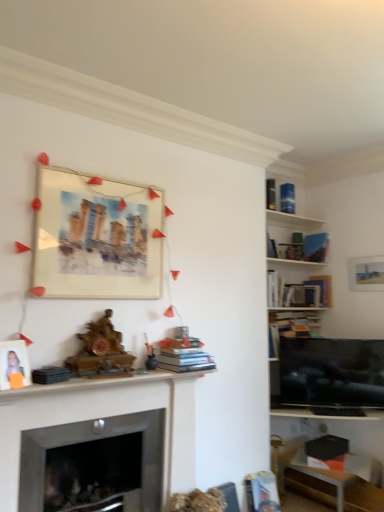
Measure the distance between point [313,228] and camera.

They are 4.35 meters apart.

Identify the location of white wooden shelf at upper right. (292, 221).

The width and height of the screenshot is (384, 512). What are the coordinates of `watercolor paper painting at upper left, the second picture frame ordered from the bottom` in the screenshot? It's located at (97, 237).

Image resolution: width=384 pixels, height=512 pixels. What do you see at coordinates (97, 237) in the screenshot?
I see `watercolor paper painting at upper left, the second picture frame ordered from the bottom` at bounding box center [97, 237].

Measure the distance between point (383,362) and camera.

Point (383,362) is 3.52 meters from camera.

What do you see at coordinates (322, 288) in the screenshot?
I see `hardcover book at center-right, which is the 4th book from front to back` at bounding box center [322, 288].

This screenshot has height=512, width=384. What are the coordinates of `hardcover book at upper right, which is the 4th book from back to front` in the screenshot? It's located at (271, 194).

What do you see at coordinates (104, 419) in the screenshot?
I see `wooden mantelpiece at center` at bounding box center [104, 419].

Identify the location of white wooden shelf at upper right. (292, 221).

From the image's perspective, is watercolor paper painting at upper left, the second picture frame ordered from the bottom, beneath blue matte bookshelf at upper right, the third book from the top?

Incorrect, from the image's perspective, watercolor paper painting at upper left, the second picture frame ordered from the bottom, is higher than blue matte bookshelf at upper right, the third book from the top.

Is point (58, 218) closer or farther from the camera than point (323, 255)?

Point (58, 218) is positioned closer to the camera compared to point (323, 255).

Is watercolor paper painting at upper left, marked as the 1th picture frame in a top-to-bottom arrangement, oriented away from blue matte bookshelf at upper right, arranged as the 1th book when viewed from the back?

No, watercolor paper painting at upper left, marked as the 1th picture frame in a top-to-bottom arrangement,'s orientation is not away from blue matte bookshelf at upper right, arranged as the 1th book when viewed from the back.

Which object is positioned more to the left, watercolor paper painting at upper left, placed as the 1th picture frame when sorted from right to left, or blue matte bookshelf at upper right, which ranks as the 6th book in left-to-right order?

watercolor paper painting at upper left, placed as the 1th picture frame when sorted from right to left, is more to the left.

Considering the positions of objects blue matte bookshelf at upper right, which ranks as the 6th book in left-to-right order, and watercolor paper painting at upper left, marked as the 1th picture frame in a top-to-bottom arrangement, in the image provided, who is behind, blue matte bookshelf at upper right, which ranks as the 6th book in left-to-right order, or watercolor paper painting at upper left, marked as the 1th picture frame in a top-to-bottom arrangement,?

blue matte bookshelf at upper right, which ranks as the 6th book in left-to-right order, is further from the camera.

Is blue matte bookshelf at upper right, the third book from the top, far from watercolor paper painting at upper left, which is the 1th picture frame in back-to-front order?

Yes, blue matte bookshelf at upper right, the third book from the top, and watercolor paper painting at upper left, which is the 1th picture frame in back-to-front order, are located far from each other.

From the image's perspective, which object appears higher, blue matte bookshelf at upper right, which ranks as the 6th book in left-to-right order, or watercolor paper painting at upper left, the second picture frame in the front-to-back sequence?

watercolor paper painting at upper left, the second picture frame in the front-to-back sequence.

Considering the relative positions of blue matte bookshelf at upper right, the third book from the top, and watercolor paper painting at upper left, which is the 1th picture frame in back-to-front order, in the image provided, is blue matte bookshelf at upper right, the third book from the top, to the left or to the right of watercolor paper painting at upper left, which is the 1th picture frame in back-to-front order,?

Based on their positions, blue matte bookshelf at upper right, the third book from the top, is located to the right of watercolor paper painting at upper left, which is the 1th picture frame in back-to-front order.

Are hardcover book at center-right, which is the 4th book from front to back, and hardcover book at upper right, acting as the 3th book starting from the right, located far from each other?

No, hardcover book at center-right, which is the 4th book from front to back, is not far away from hardcover book at upper right, acting as the 3th book starting from the right.

Considering the positions of point (326, 301) and point (288, 207), is point (326, 301) closer or farther from the camera than point (288, 207)?

Point (326, 301).

From the image's perspective, is hardcover book at center-right, the fourth book in the top-to-bottom sequence, above or below hardcover book at upper right, which appears as the 4th book when viewed from the left?

hardcover book at center-right, the fourth book in the top-to-bottom sequence, is below hardcover book at upper right, which appears as the 4th book when viewed from the left.

Between hardcover book at center-right, which is the 4th book from front to back, and hardcover book at upper right, arranged as the second book when viewed from the top, which one is positioned in front?

hardcover book at center-right, which is the 4th book from front to back, is more forward.

Do you think flat screen tv at right is within watercolor paper painting at upper left, which is the 1th picture frame in back-to-front order, or outside of it?

flat screen tv at right is spatially situated outside watercolor paper painting at upper left, which is the 1th picture frame in back-to-front order.

Between flat screen tv at right and watercolor paper painting at upper left, which is the 1th picture frame in back-to-front order, which one appears on the left side from the viewer's perspective?

From the viewer's perspective, watercolor paper painting at upper left, which is the 1th picture frame in back-to-front order, appears more on the left side.

Which point is more forward, [295,381] or [106,280]?

The point [106,280] is closer.

In the image, is flat screen tv at right positioned in front of or behind watercolor paper painting at upper left, the second picture frame in the front-to-back sequence?

In the image, flat screen tv at right appears behind watercolor paper painting at upper left, the second picture frame in the front-to-back sequence.

Looking at this image, between matte white photo frame at left, the first picture frame viewed from the front, and hardcover book at upper right, which appears as the 4th book when viewed from the left, which one has smaller size?

hardcover book at upper right, which appears as the 4th book when viewed from the left, is smaller.

Between matte white photo frame at left, the second picture frame when ordered from back to front, and hardcover book at upper right, arranged as the second book when viewed from the top, which one has larger width?

Wider between the two is hardcover book at upper right, arranged as the second book when viewed from the top.

How far apart are matte white photo frame at left, which is counted as the 1th picture frame, starting from the bottom, and hardcover book at upper right, the 5th book viewed from the front?

2.71 meters.

Is matte white photo frame at left, arranged as the 2th picture frame when viewed from the top, oriented away from hardcover book at upper right, arranged as the second book when viewed from the top?

matte white photo frame at left, arranged as the 2th picture frame when viewed from the top, is not turned away from hardcover book at upper right, arranged as the second book when viewed from the top.

From a real-world perspective, is wooden mantelpiece at center under watercolor paper painting at upper left, marked as the 1th picture frame in a top-to-bottom arrangement?

Yes, from a real-world perspective, wooden mantelpiece at center is below watercolor paper painting at upper left, marked as the 1th picture frame in a top-to-bottom arrangement.

From the picture: Which object is wider, wooden mantelpiece at center or watercolor paper painting at upper left, the second picture frame ordered from the bottom?

With larger width is wooden mantelpiece at center.

Is watercolor paper painting at upper left, the 2th picture frame positioned from the left, at the back of wooden mantelpiece at center?

No, watercolor paper painting at upper left, the 2th picture frame positioned from the left, is not at the back of wooden mantelpiece at center.

Considering the sizes of wooden mantelpiece at center and watercolor paper painting at upper left, marked as the 1th picture frame in a top-to-bottom arrangement, in the image, is wooden mantelpiece at center taller or shorter than watercolor paper painting at upper left, marked as the 1th picture frame in a top-to-bottom arrangement,?

In the image, wooden mantelpiece at center appears to be taller than watercolor paper painting at upper left, marked as the 1th picture frame in a top-to-bottom arrangement.

Considering the positions of objects blue matte bookshelf at upper right, arranged as the 1th book when viewed from the back, and wooden mantelpiece at center in the image provided, who is more to the right, blue matte bookshelf at upper right, arranged as the 1th book when viewed from the back, or wooden mantelpiece at center?

Positioned to the right is blue matte bookshelf at upper right, arranged as the 1th book when viewed from the back.

Does blue matte bookshelf at upper right, arranged as the 1th book when viewed from the back, have a lesser height compared to wooden mantelpiece at center?

Correct, blue matte bookshelf at upper right, arranged as the 1th book when viewed from the back, is not as tall as wooden mantelpiece at center.

Where is `the 3rd book above the wooden mantelpiece at center (from the image's perspective)`? Image resolution: width=384 pixels, height=512 pixels. the 3rd book above the wooden mantelpiece at center (from the image's perspective) is located at coordinates (315, 247).

This screenshot has height=512, width=384. There is a watercolor paper painting at upper left, placed as the 1th picture frame when sorted from right to left. Find the location of `the 1st book above it (from a real-world perspective)`. the 1st book above it (from a real-world perspective) is located at coordinates (315, 247).

There is a blue matte bookshelf at upper right, the third book from the top. Where is `the 1st picture frame below it (from a real-world perspective)`? The width and height of the screenshot is (384, 512). the 1st picture frame below it (from a real-world perspective) is located at coordinates (97, 237).

Estimate the real-world distances between objects in this image. Which object is closer to hardcover book at center-right, which is counted as the third book, starting from the back, white wooden shelf at upper right or wooden mantelpiece at center?

white wooden shelf at upper right.

From the image, which object appears to be nearer to hardcover books at center, the first book in the left-to-right sequence, matte white photo frame at left, the 2th picture frame viewed from the right, or white wooden shelf at upper right?

The object closer to hardcover books at center, the first book in the left-to-right sequence, is matte white photo frame at left, the 2th picture frame viewed from the right.

Based on their spatial positions, is hardcover book at center-right, which is the 2th book from right to left, or matte white photo frame at left, the second picture frame when ordered from back to front, closer to flat screen tv at right?

hardcover book at center-right, which is the 2th book from right to left, is closer to flat screen tv at right.

Based on their spatial positions, is white wooden shelf at upper right or wooden mantelpiece at center further from matte white photo frame at left, the 2th picture frame viewed from the right?

white wooden shelf at upper right is further to matte white photo frame at left, the 2th picture frame viewed from the right.

From the picture: Estimate the real-world distances between objects in this image. Which object is further from hardcover book at upper right, which appears as the 4th book when viewed from the left, blue matte bookshelf at upper right, which ranks as the 6th book in left-to-right order, or flat screen tv at right?

The object further to hardcover book at upper right, which appears as the 4th book when viewed from the left, is flat screen tv at right.

Estimate the real-world distances between objects in this image. Which object is further from hardcover book at lower right, which is counted as the fifth book, starting from the back, flat screen tv at right or white wooden shelf at upper right?

white wooden shelf at upper right lies further to hardcover book at lower right, which is counted as the fifth book, starting from the back, than the other object.

Based on the photo, from the image, which object appears to be nearer to matte white photo frame at left, the first picture frame viewed from the front, watercolor paper painting at upper left, placed as the 1th picture frame when sorted from right to left, or white wooden shelf at upper right?

Based on the image, watercolor paper painting at upper left, placed as the 1th picture frame when sorted from right to left, appears to be nearer to matte white photo frame at left, the first picture frame viewed from the front.

Based on their spatial positions, is hardcover book at upper right, the 4th book viewed from the right, or blue matte bookshelf at upper right, arranged as the 1th book when viewed from the back, closer to matte white photo frame at left, the second picture frame when ordered from back to front?

Among the two, hardcover book at upper right, the 4th book viewed from the right, is located nearer to matte white photo frame at left, the second picture frame when ordered from back to front.

At what (x,y) coordinates should I click in order to perform the action: click on shelf between hardcover book at upper right, the 1th book in the top-to-bottom sequence, and flat screen tv at right from top to bottom. Please return your answer as a coordinate pair (x, y). Looking at the image, I should click on (292, 221).

Where is `shelf that lies between hardcover book at upper right, which appears as the 4th book when viewed from the left, and hardcover book at lower right, placed as the second book when sorted from left to right, from top to bottom`? The width and height of the screenshot is (384, 512). shelf that lies between hardcover book at upper right, which appears as the 4th book when viewed from the left, and hardcover book at lower right, placed as the second book when sorted from left to right, from top to bottom is located at coordinates (292, 221).

What are the coordinates of `television situated between watercolor paper painting at upper left, marked as the 1th picture frame in a top-to-bottom arrangement, and hardcover book at center-right, which is counted as the third book, starting from the back, from left to right` in the screenshot? It's located at [332, 372].

Where is `shelf between hardcover books at center, which is counted as the second book, starting from the bottom, and hardcover book at center-right, the 5th book positioned from the left, along the z-axis`? shelf between hardcover books at center, which is counted as the second book, starting from the bottom, and hardcover book at center-right, the 5th book positioned from the left, along the z-axis is located at coordinates (292, 221).